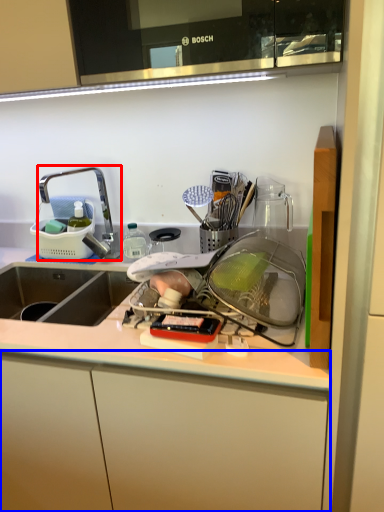
Question: Among these objects, which one is nearest to the camera, tap (highlighted by a red box) or cabinetry (highlighted by a blue box)?

Choices:
 (A) tap
 (B) cabinetry

Answer: (B)